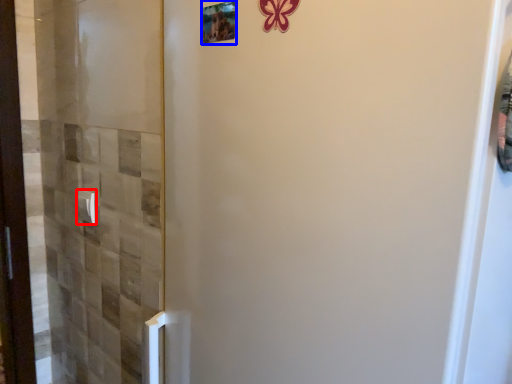
Question: Which point is closer to the camera, door handle (highlighted by a red box) or picture frame (highlighted by a blue box)?

Choices:
 (A) door handle
 (B) picture frame

Answer: (B)